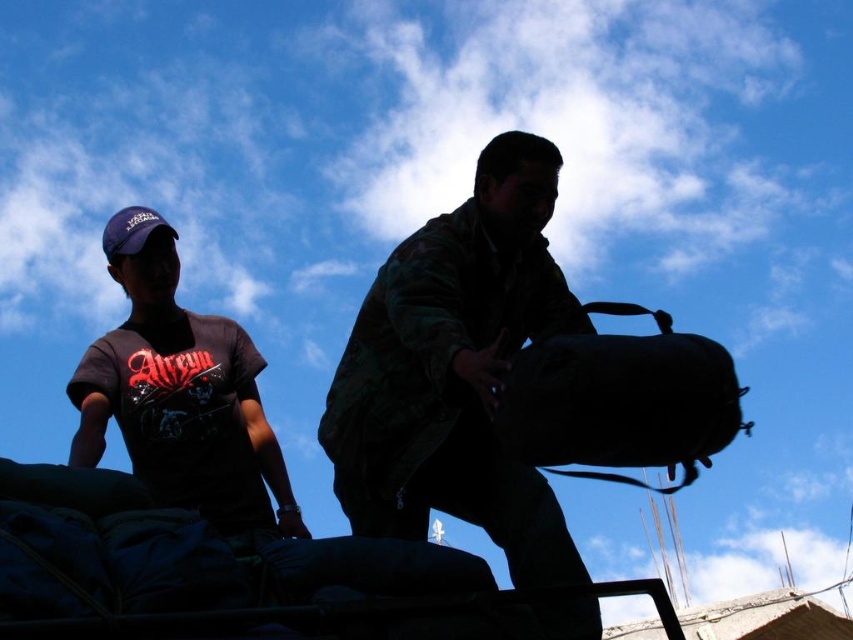
Question: Observing the image, what is the correct spatial positioning of dark camouflage jacket at upper center in reference to black fabric bag at right?

Choices:
 (A) left
 (B) right

Answer: (A)

Question: Which of the following is the closest to the observer?

Choices:
 (A) (701, 371)
 (B) (199, 388)

Answer: (A)

Question: Is dark camouflage jacket at upper center above black fabric bag at right?

Choices:
 (A) yes
 (B) no

Answer: (B)

Question: Which object appears closest to the camera in this image?

Choices:
 (A) camo fabric backpack at center
 (B) black fabric bag at right

Answer: (A)

Question: Estimate the real-world distances between objects in this image. Which object is farther from the camo fabric backpack at center?

Choices:
 (A) black fabric bag at right
 (B) dark camouflage jacket at upper center

Answer: (A)

Question: Can you confirm if camo fabric backpack at center is positioned above dark camouflage jacket at upper center?

Choices:
 (A) no
 (B) yes

Answer: (B)